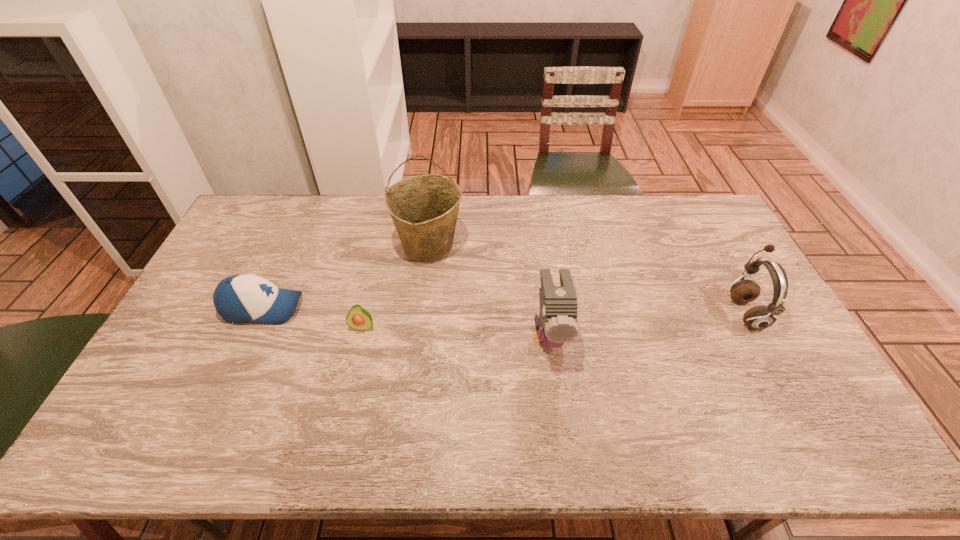
You are a GUI agent. You are given a task and a screenshot of the screen. Output one action in this format:
    pyautogui.click(x=<x>, y=<y>)
    Task: Click on the tallest object
    This screenshot has height=540, width=960.
    Given the screenshot: What is the action you would take?
    pyautogui.click(x=424, y=208)

You are a GUI agent. You are given a task and a screenshot of the screen. Output one action in this format:
    pyautogui.click(x=<x>, y=<y>)
    Task: Click on the farthest object
    The width and height of the screenshot is (960, 540).
    Given the screenshot: What is the action you would take?
    pyautogui.click(x=424, y=208)

I want to click on the rightmost object, so click(x=760, y=317).

At what (x,y) coordinates should I click in order to perform the action: click on bird. Please return your answer as a coordinate pair (x, y). The image size is (960, 540). Looking at the image, I should click on (557, 323).

The width and height of the screenshot is (960, 540). I want to click on the leftmost object, so coord(241,298).

Where is `the fourth object from right to left`? This screenshot has height=540, width=960. the fourth object from right to left is located at coordinates (358, 318).

Identify the location of vacant space located on the right of the farthest object. The width and height of the screenshot is (960, 540). (567, 246).

Where is `vacant area situated 0.310m on the ear pads of the earphone`? vacant area situated 0.310m on the ear pads of the earphone is located at coordinates (628, 312).

Where is `vacant point located on the ear pads of the earphone`? The height and width of the screenshot is (540, 960). vacant point located on the ear pads of the earphone is located at coordinates (658, 312).

The image size is (960, 540). I want to click on free space located 0.330m on the ear pads of the earphone, so click(x=621, y=312).